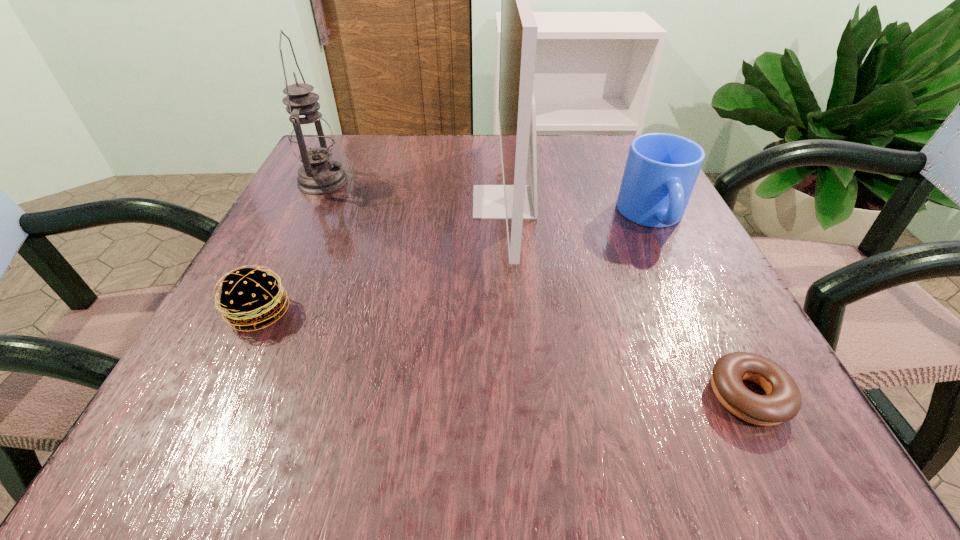
Image resolution: width=960 pixels, height=540 pixels. In order to click on unoccupied position between the doughnut and the patty in this screenshot , I will do `click(503, 354)`.

At what (x,y) coordinates should I click in order to perform the action: click on free spot between the oil lamp and the second shortest object. Please return your answer as a coordinate pair (x, y). Image resolution: width=960 pixels, height=540 pixels. Looking at the image, I should click on (291, 247).

This screenshot has width=960, height=540. What are the coordinates of `vacant space in between the patty and the mug` in the screenshot? It's located at (456, 265).

Where is `empty location between the fourth shortest object and the patty`? empty location between the fourth shortest object and the patty is located at coordinates (291, 247).

Locate an element on the screen. unoccupied position between the doughnut and the third tallest object is located at coordinates (700, 306).

Find the location of a particular element. This screenshot has width=960, height=540. free space between the third object from left to right and the oil lamp is located at coordinates (414, 192).

You are a GUI agent. You are given a task and a screenshot of the screen. Output one action in this format:
    pyautogui.click(x=<x>, y=<y>)
    Task: Click on the free point between the shortest object and the patty
    The width and height of the screenshot is (960, 540).
    Given the screenshot: What is the action you would take?
    pyautogui.click(x=503, y=354)

Image resolution: width=960 pixels, height=540 pixels. Find the location of `vacant area that lies between the oil lamp and the tallest object`. vacant area that lies between the oil lamp and the tallest object is located at coordinates (414, 192).

Where is `free space that is in between the shortest object and the monitor`? free space that is in between the shortest object and the monitor is located at coordinates click(626, 299).

Find the location of a particular element. The height and width of the screenshot is (540, 960). object that is the closest to the second shortest object is located at coordinates (311, 139).